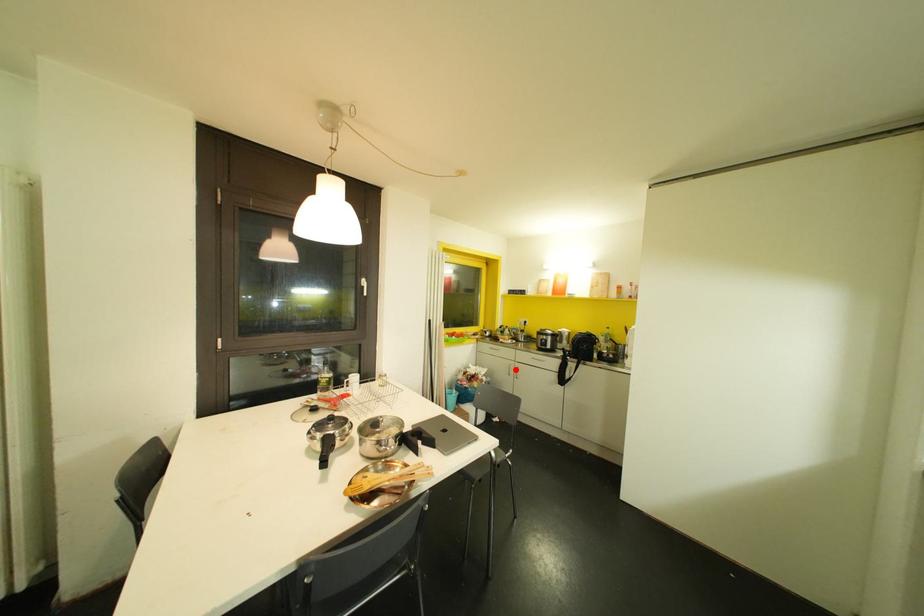
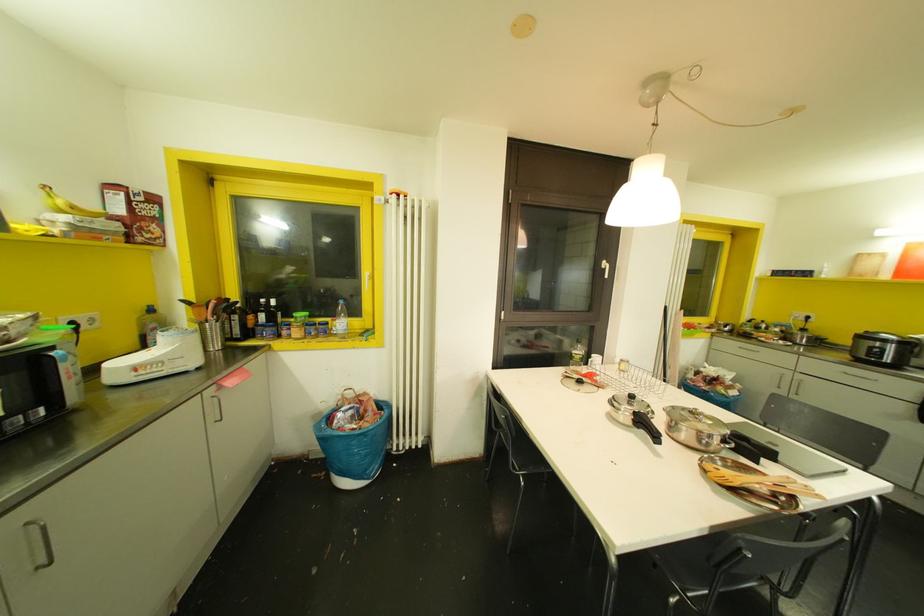
Locate, in the second image, the point that corresponds to the highlighted location in the first image.

(796, 383)